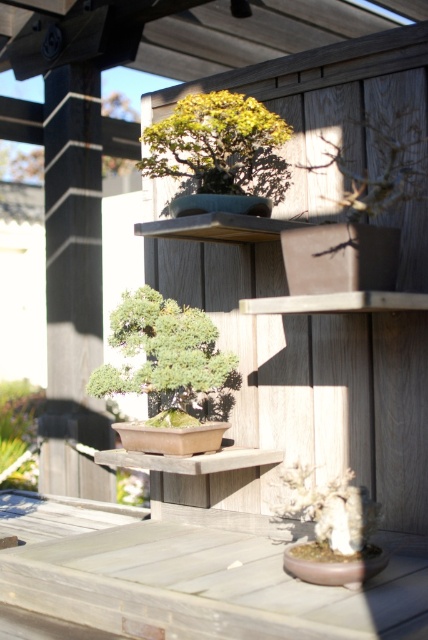
You are a gardener who needs to water both bonsai trees. The watering can you have can only reach 18 inches. Can you water the green matte bonsai tree at upper center from the green matte bonsai tree at center without moving the can?

The green matte bonsai tree at upper center is 18.65 inches away from the green matte bonsai tree at center. Since the watering can can only reach 18 inches, you cannot water the green matte bonsai tree at upper center from the green matte bonsai tree at center without moving the can.

From the picture: You are an apprentice bonsai caretaker standing in front of the wooden shelves. You need to water both the green matte bonsai tree at upper center and the green matte bonsai tree at center. Which one should you water first if you want to avoid getting water on the lower one?

You should water the green matte bonsai tree at center first because the green matte bonsai tree at upper center is located above it. Watering the lower one first would prevent water from dripping onto it after watering the upper one.